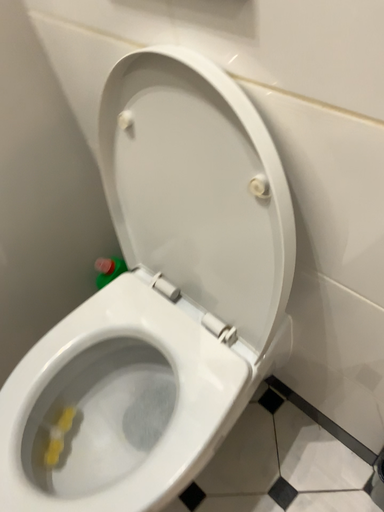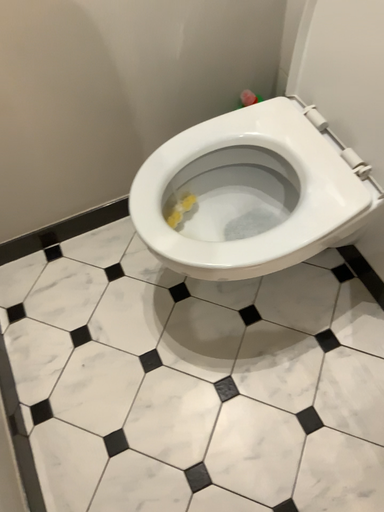
Question: How did the camera likely rotate when shooting the video?

Choices:
 (A) rotated right
 (B) rotated left

Answer: (B)